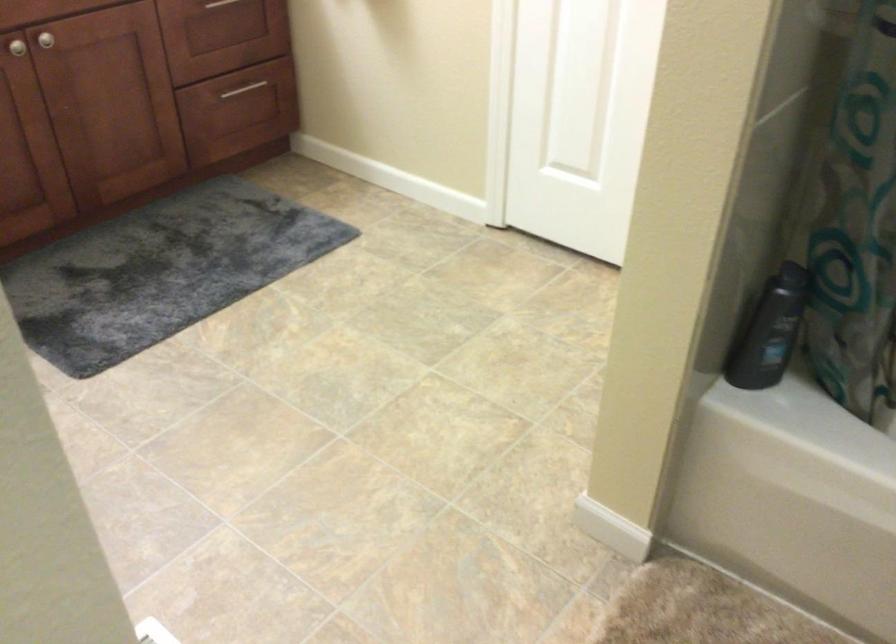
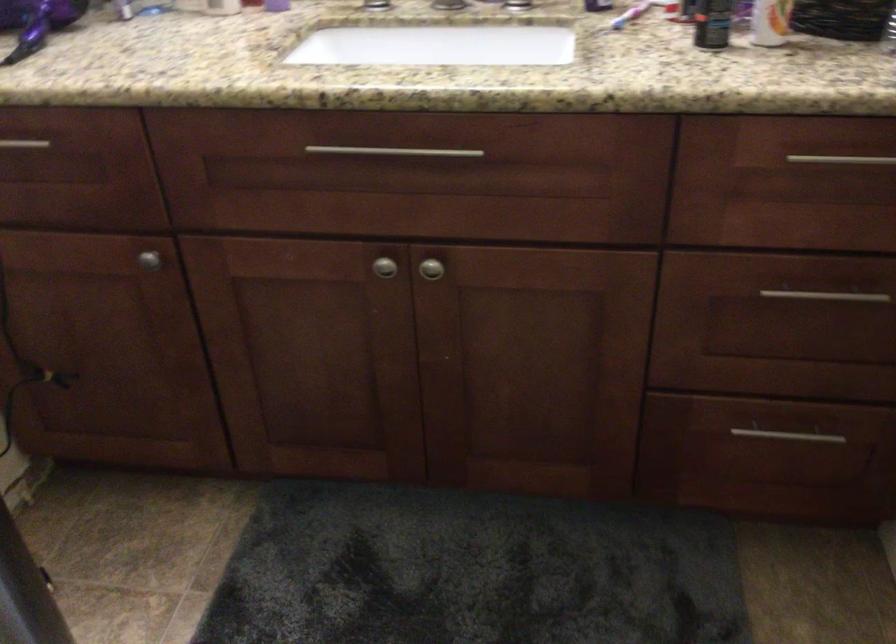
Find the pixel in the second image that matches point (250, 102) in the first image.

(778, 446)